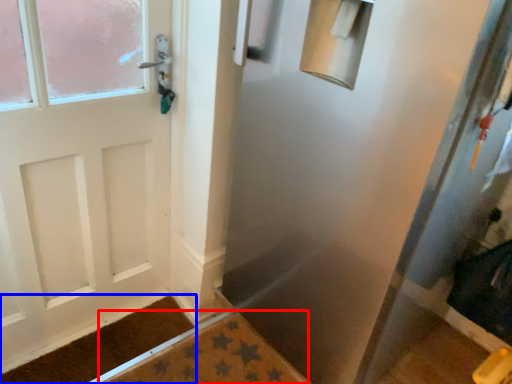
Question: Which object appears farthest to the camera in this image, bath mat (highlighted by a red box) or doormat (highlighted by a blue box)?

Choices:
 (A) bath mat
 (B) doormat

Answer: (B)